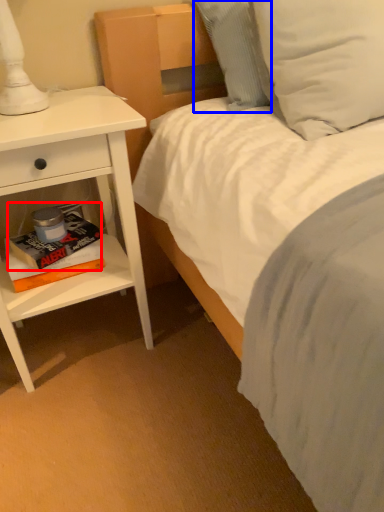
Question: Among these objects, which one is farthest to the camera, paperback book (highlighted by a red box) or pillow (highlighted by a blue box)?

Choices:
 (A) paperback book
 (B) pillow

Answer: (A)